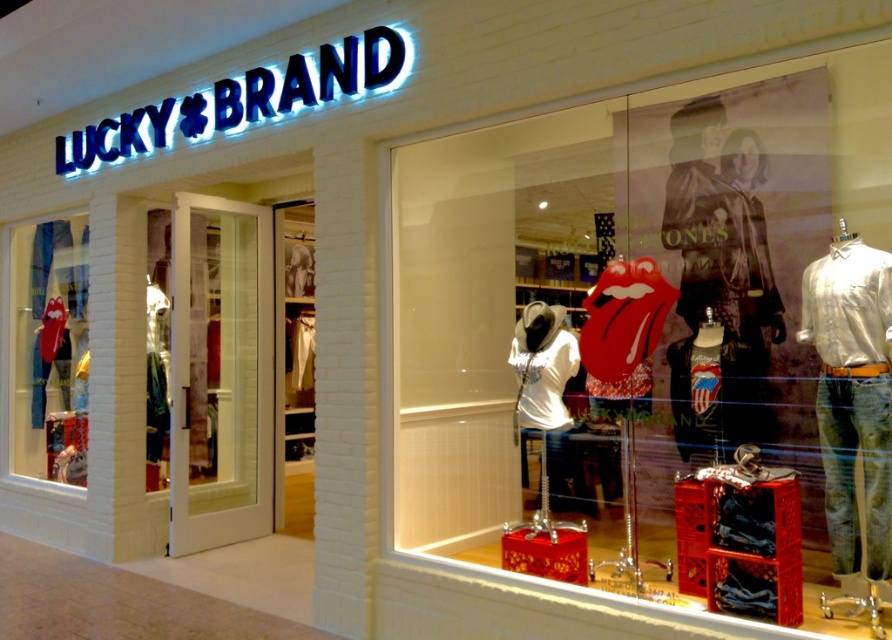
Measure the distance between point [556,396] and camera.

The distance of point [556,396] from camera is 3.88 meters.

Who is more forward, (646, 556) or (76, 228)?

Point (646, 556)

Between point (535, 372) and point (81, 448), which one is positioned in front?

Point (535, 372)

Where is `matte red crate at center`? The height and width of the screenshot is (640, 892). matte red crate at center is located at coordinates (654, 332).